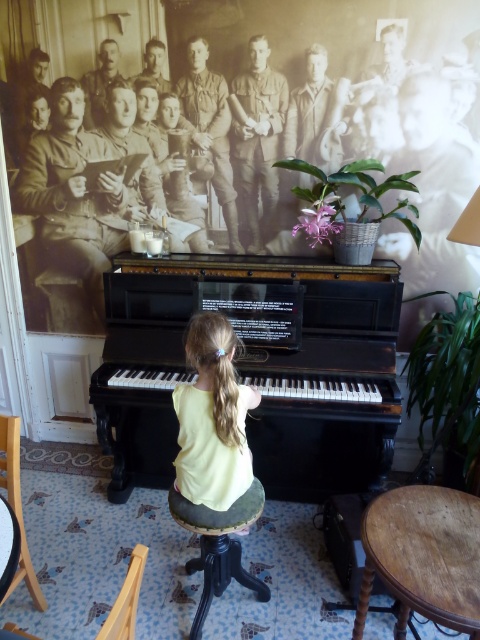
Between black polished piano at center and wooden at lower left, which one is positioned higher?

black polished piano at center

Is black polished piano at center further to camera compared to wooden at lower left?

Yes, black polished piano at center is further from the viewer.

Which is behind, point (321, 298) or point (121, 625)?

The point (321, 298) is behind.

I want to click on black polished piano at center, so click(255, 365).

Is black polished piano at center positioned before yellow cotton shirt at center?

No, black polished piano at center is behind yellow cotton shirt at center.

Does black polished piano at center have a lesser width compared to yellow cotton shirt at center?

No.

This screenshot has height=640, width=480. Describe the element at coordinates (255, 365) in the screenshot. I see `black polished piano at center` at that location.

Identify the location of black polished piano at center. This screenshot has height=640, width=480. (255, 365).

Does black polished piano at center appear under dark wood stool at center?

Incorrect, black polished piano at center is not positioned below dark wood stool at center.

Can you confirm if black polished piano at center is smaller than dark wood stool at center?

Incorrect, black polished piano at center is not smaller in size than dark wood stool at center.

Image resolution: width=480 pixels, height=640 pixels. Identify the location of black polished piano at center. (255, 365).

Locate an element on the screen. This screenshot has height=640, width=480. black polished piano at center is located at coordinates (255, 365).